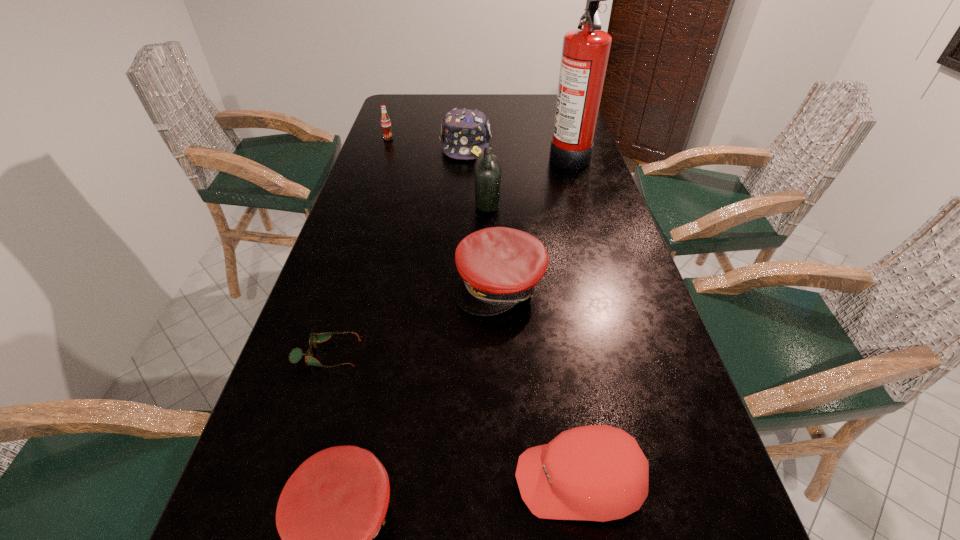
The height and width of the screenshot is (540, 960). I want to click on vacant space at the left edge, so (410, 123).

The image size is (960, 540). What are the coordinates of `vacant space at the right edge` in the screenshot? It's located at click(x=607, y=192).

Image resolution: width=960 pixels, height=540 pixels. In the image, there is a desktop. Find the location of `vacant space at the far left corner`. vacant space at the far left corner is located at coordinates (418, 98).

Locate an element on the screen. This screenshot has height=540, width=960. free space at the far right corner of the desktop is located at coordinates (544, 98).

In order to click on free spot between the third nearest cap and the tallest object in this screenshot , I will do `click(534, 220)`.

The image size is (960, 540). Find the location of `free space between the shortest object and the fourth farthest object`. free space between the shortest object and the fourth farthest object is located at coordinates (407, 279).

At what (x,y) coordinates should I click in order to perform the action: click on vacant area that lies between the tallest object and the third nearest cap. Please return your answer as a coordinate pair (x, y). This screenshot has height=540, width=960. Looking at the image, I should click on (534, 220).

The height and width of the screenshot is (540, 960). Identify the location of free space between the bottle and the soda. (438, 171).

This screenshot has width=960, height=540. Find the location of `object that is the sixth closest one to the farthest cap`. object that is the sixth closest one to the farthest cap is located at coordinates (599, 473).

The height and width of the screenshot is (540, 960). In order to click on object that is the sixth closest to the soda in this screenshot , I will do `click(333, 505)`.